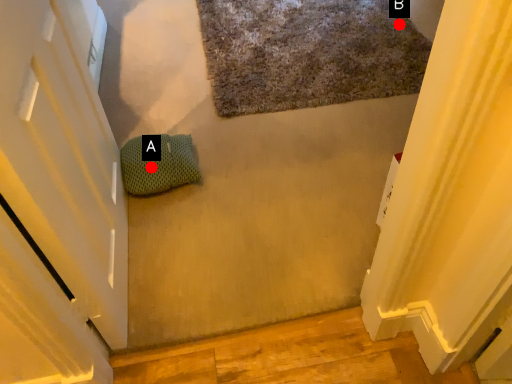
Question: Two points are circled on the image, labeled by A and B beside each circle. Which point is closer to the camera taking this photo?

Choices:
 (A) A is closer
 (B) B is closer

Answer: (A)